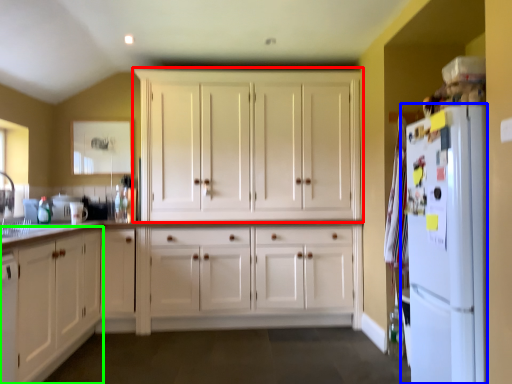
Question: Which object is the farthest from cabinetry (highlighted by a red box)? Choose among these: refrigerator (highlighted by a blue box) or cabinetry (highlighted by a green box).

Choices:
 (A) refrigerator
 (B) cabinetry

Answer: (A)